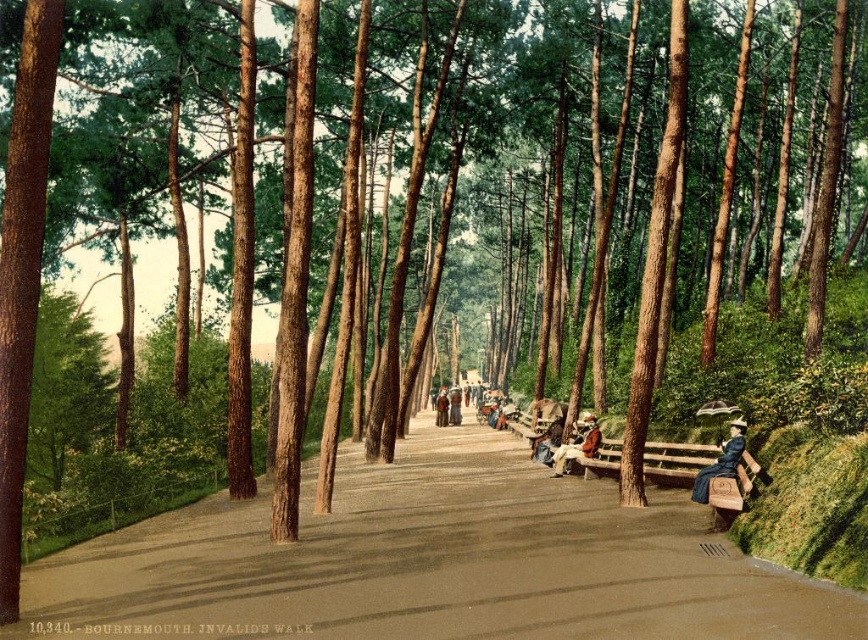
Question: Estimate the real-world distances between objects in this image. Which object is farther from the wooden bench at center?

Choices:
 (A) denim jacket at center
 (B) brown asphalt path at center

Answer: (B)

Question: Is brown asphalt path at center to the right of wooden bench at right from the viewer's perspective?

Choices:
 (A) yes
 (B) no

Answer: (B)

Question: Which point is closer to the camera taking this photo?

Choices:
 (A) (546, 428)
 (B) (613, 500)
 (C) (439, 417)

Answer: (B)

Question: Among these points, which one is nearest to the camera?

Choices:
 (A) pos(607,472)
 (B) pos(444,392)
 (C) pos(582,449)
 (D) pos(415,560)

Answer: (D)

Question: Is brown asphalt path at center positioned behind blue fabric dress at right?

Choices:
 (A) yes
 (B) no

Answer: (B)

Question: Does wooden bench at right appear over blue fabric dress at right?

Choices:
 (A) yes
 (B) no

Answer: (B)